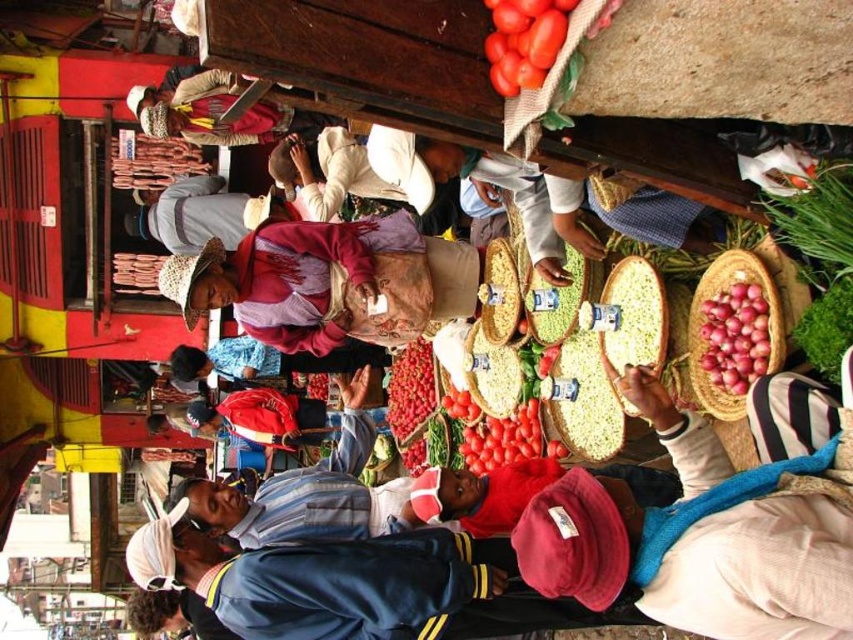
Which is in front, point (761, 497) or point (271, 584)?

Point (761, 497)

This screenshot has width=853, height=640. In order to click on striped fabric shirt at upper right in this screenshot , I will do `click(705, 532)`.

Looking at this image, is blue fabric jacket at lower left taller than smooth red tomatoes at center?

Yes, blue fabric jacket at lower left is taller than smooth red tomatoes at center.

This screenshot has width=853, height=640. What do you see at coordinates (318, 580) in the screenshot? I see `blue fabric jacket at lower left` at bounding box center [318, 580].

Does point (459, 536) come behind point (509, 61)?

Yes, it is behind point (509, 61).

I want to click on blue fabric jacket at lower left, so coord(318,580).

Between point (180, 182) and point (718, 410), which one is positioned behind?

Point (180, 182)

Which is more to the right, matte purple scarf at center or brown woven basket at right?

brown woven basket at right is more to the right.

I want to click on matte purple scarf at center, so click(x=202, y=214).